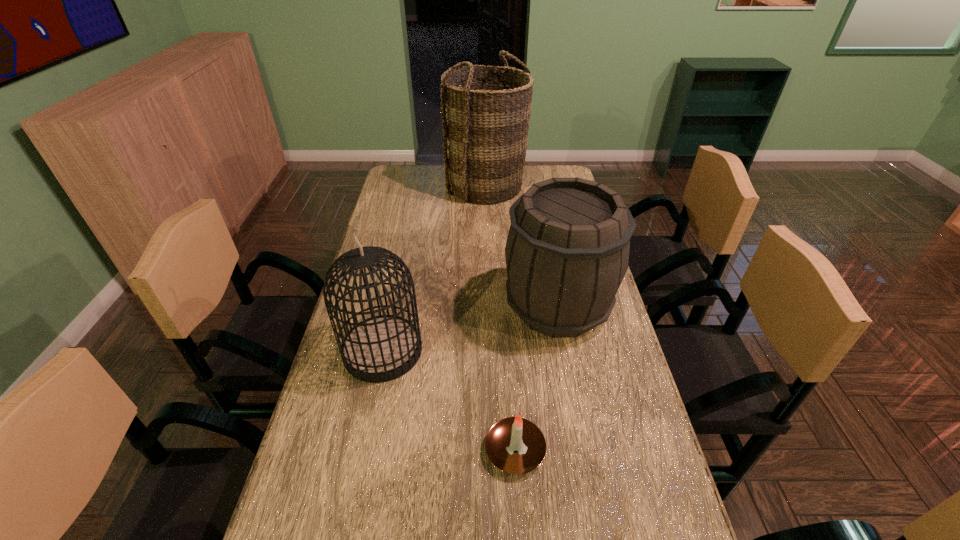
Locate an element on the screen. This screenshot has height=540, width=960. object that is at the far edge is located at coordinates (485, 117).

Identify the location of object that is at the left edge. (382, 348).

At what (x,y) coordinates should I click in order to perform the action: click on object present at the right edge. Please return your answer as a coordinate pair (x, y). The height and width of the screenshot is (540, 960). Looking at the image, I should click on (567, 251).

Where is `vacant region at the left edge of the desktop`? The height and width of the screenshot is (540, 960). vacant region at the left edge of the desktop is located at coordinates (349, 411).

Where is `blank space at the far left corner`? The height and width of the screenshot is (540, 960). blank space at the far left corner is located at coordinates (407, 180).

The image size is (960, 540). I want to click on free space between the birdcage and the candle, so click(x=449, y=400).

In order to click on vacant point located between the wine bucket and the candle in this screenshot , I will do `click(537, 378)`.

You are a GUI agent. You are given a task and a screenshot of the screen. Output one action in this format:
    pyautogui.click(x=<x>, y=<y>)
    Task: Click on the free area in between the farthest object and the nearest object
    This screenshot has height=540, width=960.
    Given the screenshot: What is the action you would take?
    pyautogui.click(x=500, y=318)

Where is `free space between the tallest object and the nearest object`? free space between the tallest object and the nearest object is located at coordinates (500, 318).

Choose which object is the second nearest neighbor to the wine bucket. Please provide its 2D coordinates. Your answer should be formatted as a tuple, i.e. [(x, y)], where the tuple contains the x and y coordinates of a point satisfying the conditions above.

[(382, 348)]